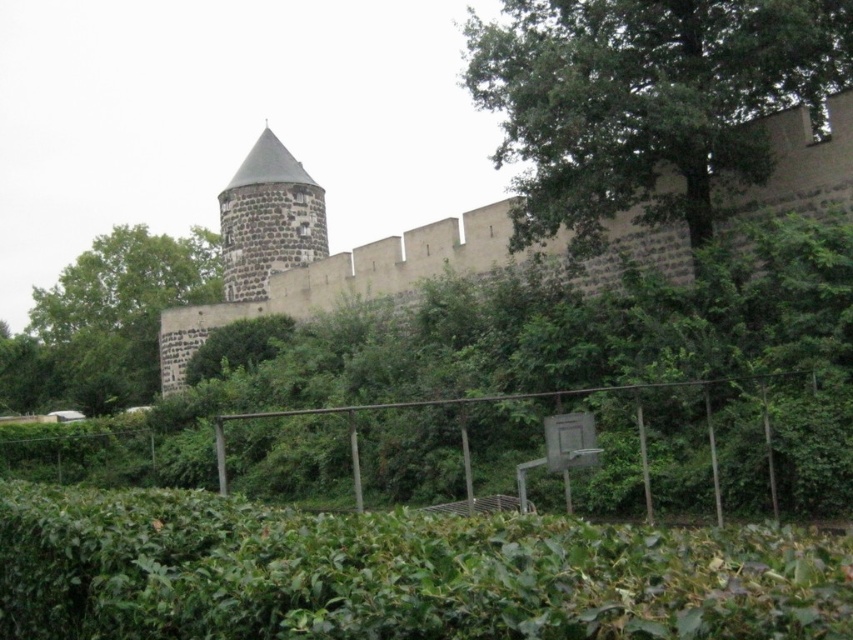
You are standing in front of the historic stone wall and notice two green leafy plants. One is the green leafy hedge at lower center and the other is the green leafy tree at center. Which one is positioned to the right side of the other?

The green leafy hedge at lower center is positioned to the right of the green leafy tree at center.

You are an architect designing a new garden layout. You want to place a small statue between the green leafy tree at upper right and the green leafy tree at center. Based on their positions, where should the statue be placed to ensure it is between both trees?

The statue should be placed below the green leafy tree at upper right and above the green leafy tree at center since the green leafy tree at upper right is positioned over the green leafy tree at center.

You are a gardener who wants to trim the green leafy hedge at lower center and the green leafy tree at upper right. Which of the two plants requires a ladder to reach its highest branches?

The green leafy tree at upper right requires a ladder to reach its highest branches because it is taller than the green leafy hedge at lower center.